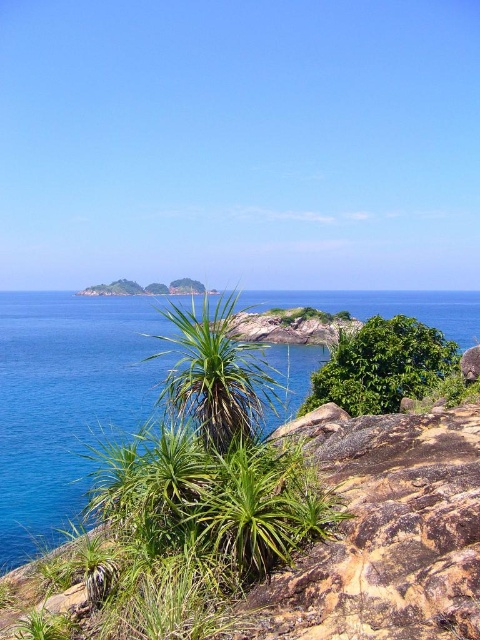
Which of these two, blue clear water at center or green leafy bush at center, stands taller?

With more height is blue clear water at center.

Can you confirm if blue clear water at center is taller than green leafy bush at center?

Yes.

Identify the location of blue clear water at center. Image resolution: width=480 pixels, height=640 pixels. (68, 403).

Between blue clear water at center and green leafy plant at center, which one appears on the left side from the viewer's perspective?

blue clear water at center

Which is behind, point (24, 484) or point (210, 365)?

Positioned behind is point (24, 484).

The image size is (480, 640). Identify the location of blue clear water at center. (68, 403).

Which is below, green leafy plant at center or green leafy bush at center?

green leafy plant at center is lower down.

Is green leafy plant at center closer to camera compared to green leafy bush at center?

Yes, green leafy plant at center is closer to the viewer.

The image size is (480, 640). Describe the element at coordinates (216, 376) in the screenshot. I see `green leafy plant at center` at that location.

Where is `green leafy plant at center`? This screenshot has width=480, height=640. green leafy plant at center is located at coordinates (216, 376).